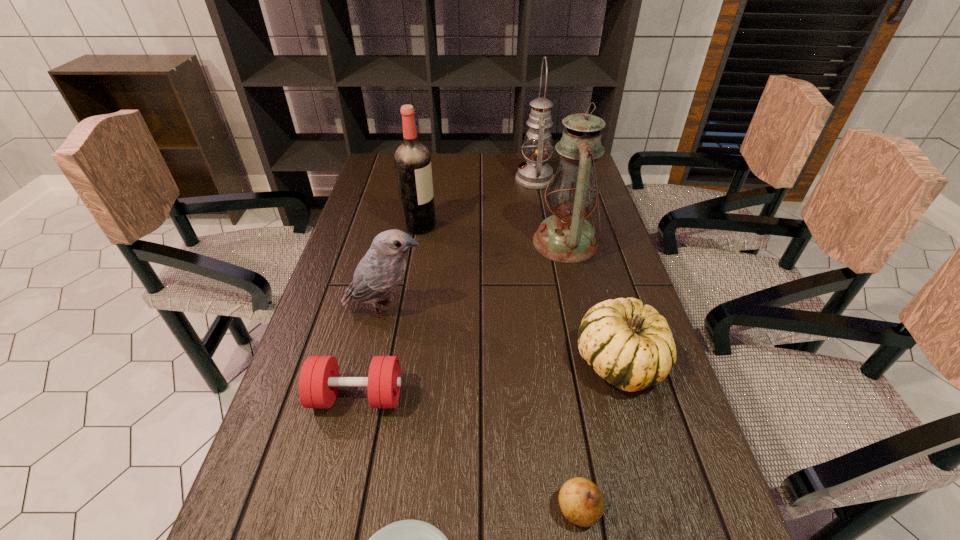
The width and height of the screenshot is (960, 540). Identify the location of free space between the farthest object and the dumbbell. (446, 288).

Locate which object ranks second in proximity to the fifth tallest object. Please provide its 2D coordinates. Your answer should be formatted as a tuple, i.e. [(x, y)], where the tuple contains the x and y coordinates of a point satisfying the conditions above.

[(566, 236)]

Where is `object identified as the fourth closest to the pear`? object identified as the fourth closest to the pear is located at coordinates (378, 273).

I want to click on free spot that satisfies the following two spatial constraints: 1. on the front-facing side of the fourth farthest object; 2. on the back side of the pear, so click(342, 509).

Identify the location of free space in the image that satisfies the following two spatial constraints: 1. on the back side of the pear; 2. on the front-facing side of the liquor. (535, 226).

The image size is (960, 540). Identify the location of free spot that satisfies the following two spatial constraints: 1. on the back side of the pear; 2. on the right side of the farther oil lamp. (527, 179).

What are the coordinates of `free region that satisfies the following two spatial constraints: 1. on the front-facing side of the liquor; 2. on the right side of the fourth shortest object` in the screenshot? It's located at (396, 362).

Where is `blank space that satisfies the following two spatial constraints: 1. on the front-facing side of the fourth tallest object; 2. on the back side of the pear`? The width and height of the screenshot is (960, 540). blank space that satisfies the following two spatial constraints: 1. on the front-facing side of the fourth tallest object; 2. on the back side of the pear is located at coordinates (342, 509).

Identify the location of free space that satisfies the following two spatial constraints: 1. on the back side of the farthest object; 2. on the right side of the pear. The width and height of the screenshot is (960, 540). (527, 179).